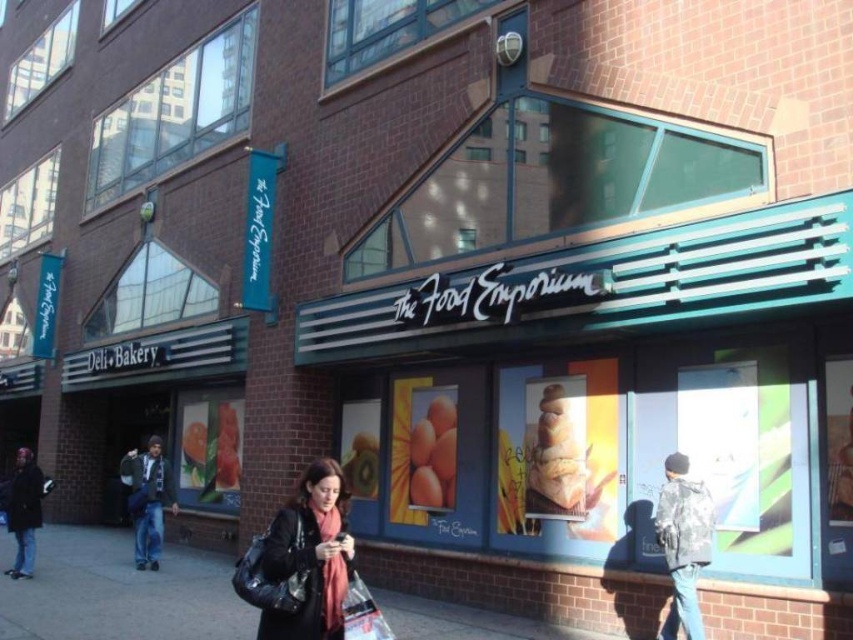
Question: Which object is closer to the camera taking this photo?

Choices:
 (A) jeans at left
 (B) golden brown bread at center

Answer: (B)

Question: Does camouflage jacket at lower right appear on the left side of jeans at left?

Choices:
 (A) yes
 (B) no

Answer: (B)

Question: Which point is closer to the camera?

Choices:
 (A) smooth green cucumber at center
 (B) plastic shopping bag at lower center
 (C) jeans at left

Answer: (B)

Question: Does golden brown bread at center appear on the right side of smooth green cucumber at center?

Choices:
 (A) no
 (B) yes

Answer: (B)

Question: Can you confirm if dark gray jacket at lower left is bigger than plastic shopping bag at lower center?

Choices:
 (A) no
 (B) yes

Answer: (B)

Question: Which point appears farthest from the camera in this image?

Choices:
 (A) (231, 403)
 (B) (326, 582)
 (C) (460, 611)
 (D) (422, 433)

Answer: (A)